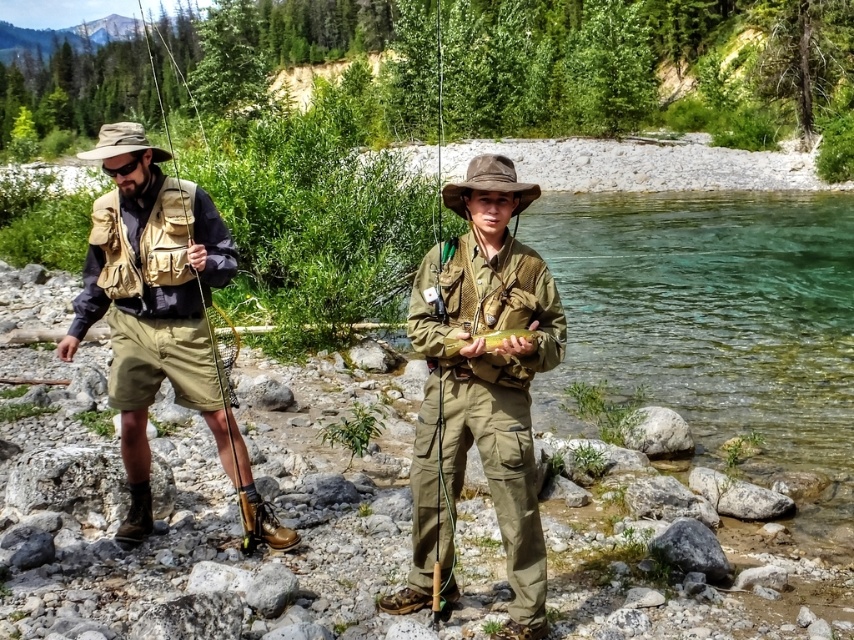
Question: Is matte khaki uniform at center below matte khaki shorts at left?

Choices:
 (A) yes
 (B) no

Answer: (A)

Question: Does matte khaki uniform at center appear over matte brown fishing pole at left?

Choices:
 (A) yes
 (B) no

Answer: (B)

Question: In this image, where is matte khaki uniform at center located relative to shiny yellow fish at center?

Choices:
 (A) left
 (B) right

Answer: (A)

Question: Which object appears farthest from the camera in this image?

Choices:
 (A) matte khaki shorts at left
 (B) shiny yellow fish at center
 (C) matte brown fishing pole at left

Answer: (C)

Question: Based on their relative distances, which object is nearer to the matte khaki shorts at left?

Choices:
 (A) matte brown fishing pole at left
 (B) matte khaki uniform at center
 (C) shiny yellow fish at center

Answer: (C)

Question: Which object appears farthest from the camera in this image?

Choices:
 (A) shiny yellow fish at center
 (B) matte khaki shorts at left
 (C) matte khaki uniform at center
 (D) matte brown fishing pole at left

Answer: (D)